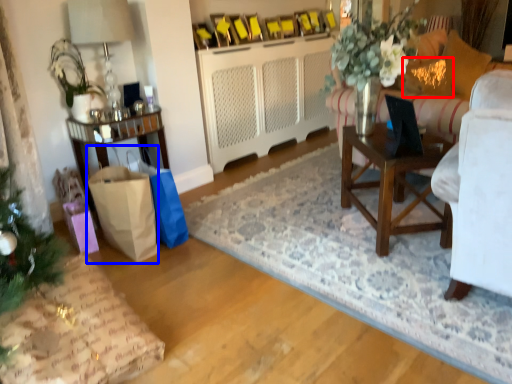
Question: Among these objects, which one is nearest to the camera, pillow (highlighted by a red box) or shopping bag (highlighted by a blue box)?

Choices:
 (A) pillow
 (B) shopping bag

Answer: (B)